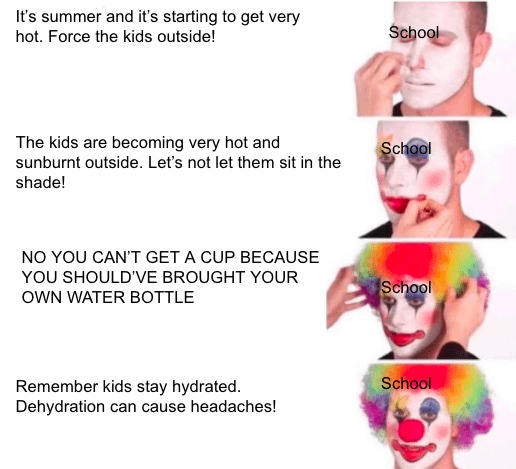
You are a GUI agent. You are given a task and a screenshot of the screen. Output one action in this format:
    pyautogui.click(x=<x>, y=<y>)
    Task: Click on the makeup
    
    Given the screenshot: What is the action you would take?
    pyautogui.click(x=461, y=87)